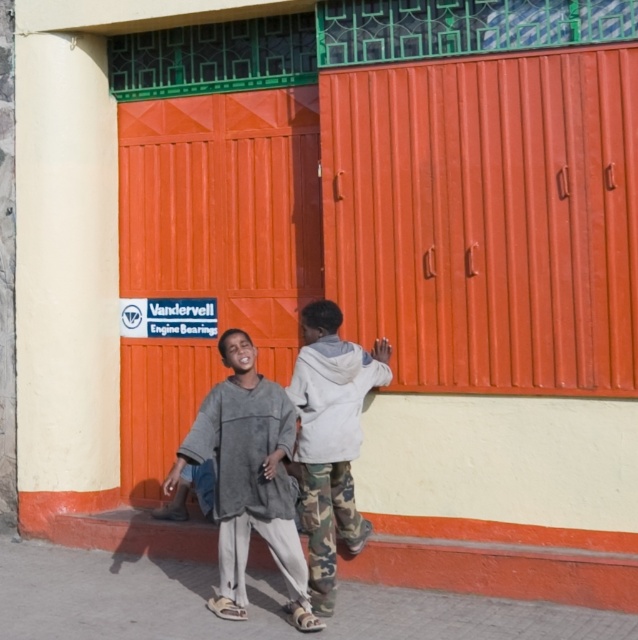
From the picture: Who is taller, orange corrugated metal at center or gray fleece sweater at lower left?

orange corrugated metal at center

Who is positioned more to the left, orange corrugated metal at center or gray fleece sweater at lower left?

gray fleece sweater at lower left

Which is behind, point (297, 204) or point (302, 614)?

Positioned behind is point (297, 204).

The height and width of the screenshot is (640, 638). In order to click on orange corrugated metal at center in this screenshot , I will do point(406,214).

Does orange corrugated metal door at center appear on the left side of gray fleece sweater at lower left?

Yes, orange corrugated metal door at center is to the left of gray fleece sweater at lower left.

Is the position of orange corrugated metal door at center less distant than that of gray fleece sweater at lower left?

No, it is behind gray fleece sweater at lower left.

Who is more distant from viewer, [202,344] or [283,410]?

The point [202,344] is more distant.

Image resolution: width=638 pixels, height=640 pixels. Identify the location of orange corrugated metal door at center. (211, 252).

Based on the photo, is gray fleece sweater at lower left to the left of camouflage pants at center from the viewer's perspective?

Yes, gray fleece sweater at lower left is to the left of camouflage pants at center.

This screenshot has width=638, height=640. I want to click on gray fleece sweater at lower left, so click(x=248, y=477).